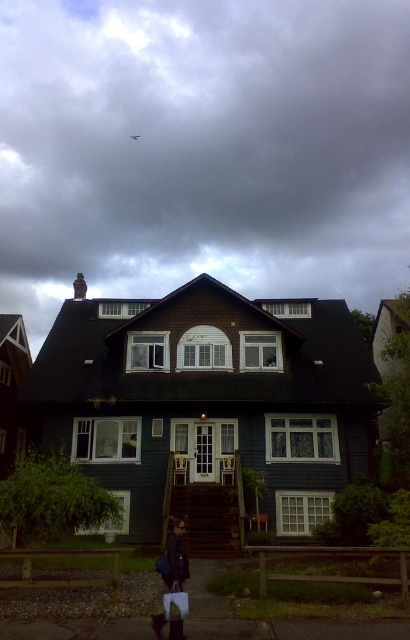
You are standing in the garden of the house and see the dark blue fabric bag at lower center and the metallic gray plane at upper center. Which object is closer to you?

The dark blue fabric bag at lower center is closer to you because it is in front of the metallic gray plane at upper center.

You are a weather balloon operator planning to launch a balloon from the dark wood house at center. The balloon can safely ascend up to the height of the dark gray cloud at upper center. Based on the scene, will the balloon reach the cloud?

The dark gray cloud at upper center is wider than the dark wood house at center, but since the question is about vertical height, the description does not provide information about the vertical distance between the house and the cloud. Therefore, it cannot be determined if the balloon will reach the cloud based on the given information.